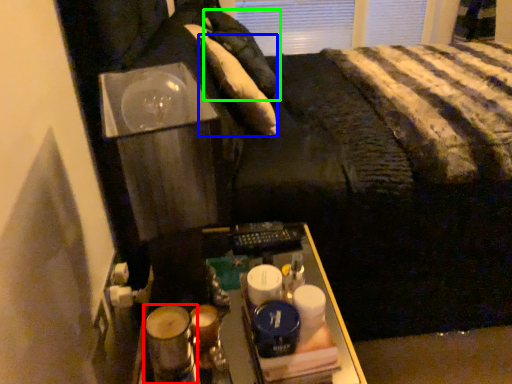
Question: Considering the real-world distances, which object is farthest from beverage (highlighted by a red box)? pillow (highlighted by a blue box) or pillow (highlighted by a green box)?

Choices:
 (A) pillow
 (B) pillow

Answer: (B)